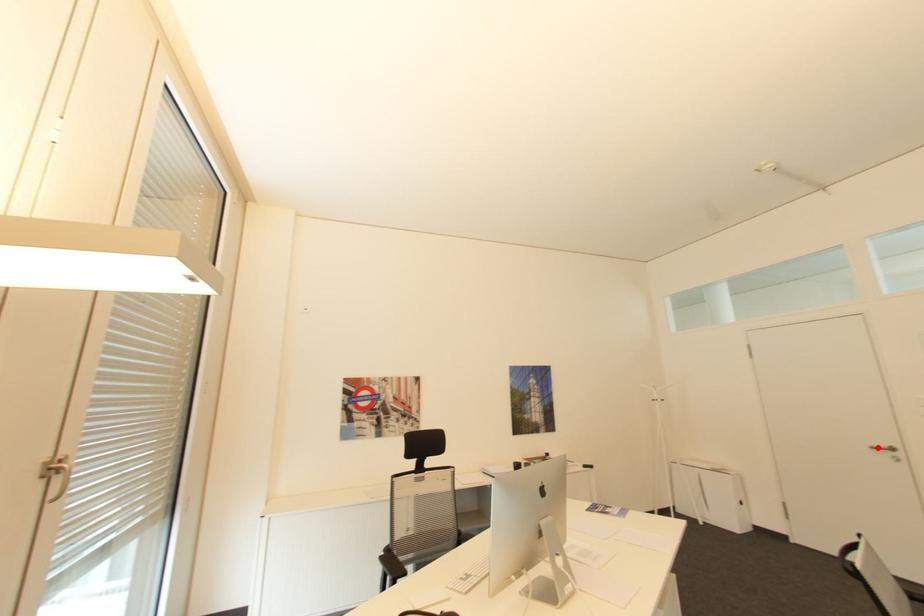
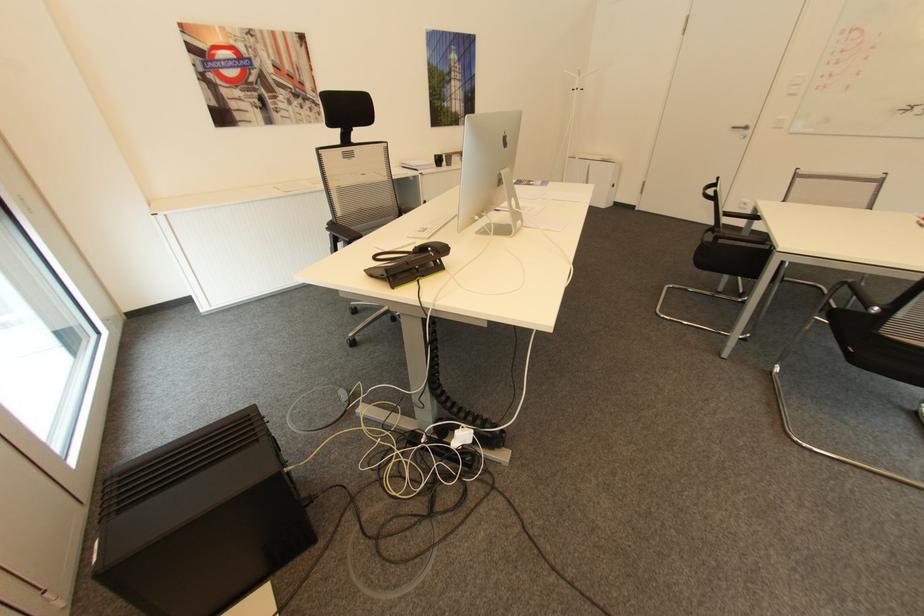
Where in the second image is the point corresponding to the highlighted location from the first image?

(736, 128)